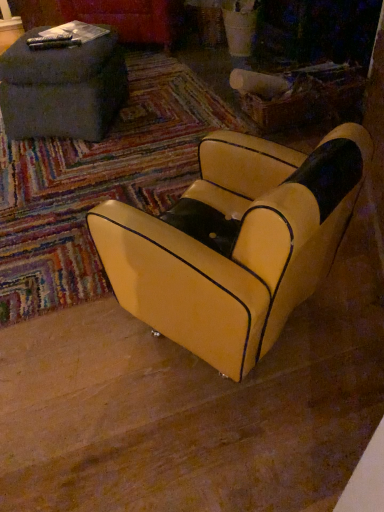
Image resolution: width=384 pixels, height=512 pixels. In order to click on vacant space in front of dark gray fabric ottoman at upper left in this screenshot , I will do `click(80, 166)`.